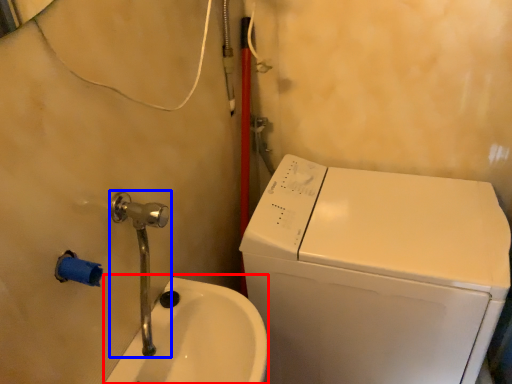
Question: Among these objects, which one is nearest to the camera, sink (highlighted by a red box) or plumbing fixture (highlighted by a blue box)?

Choices:
 (A) sink
 (B) plumbing fixture

Answer: (B)